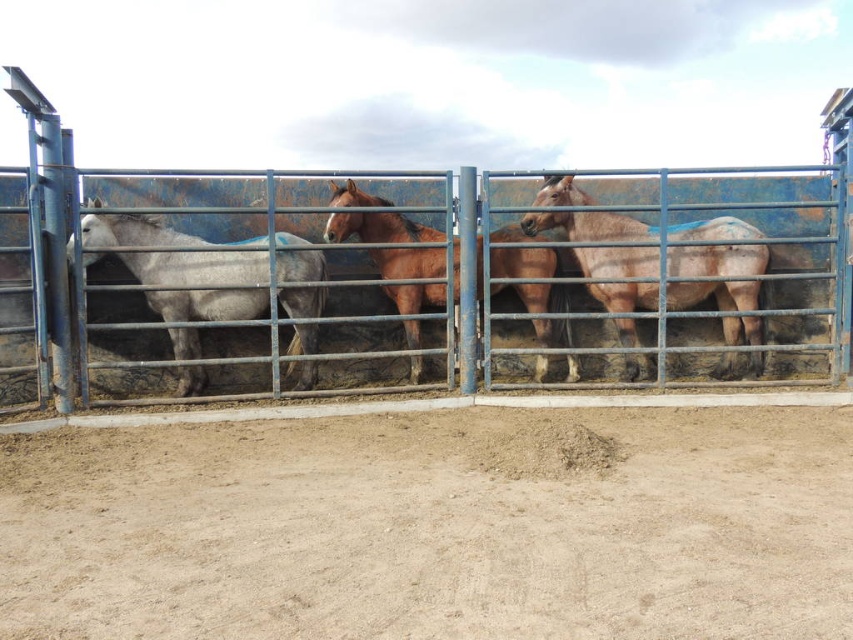
Question: Is gray matte horse at left bigger than brown glossy horse at center?

Choices:
 (A) no
 (B) yes

Answer: (A)

Question: Can you confirm if brown matte horse at center is positioned above gray matte horse at left?

Choices:
 (A) yes
 (B) no

Answer: (A)

Question: Which point is closer to the camera taking this photo?

Choices:
 (A) (555, 220)
 (B) (404, 218)
 (C) (117, 369)
 (D) (125, 234)

Answer: (D)

Question: Among these points, which one is farthest from the camera?

Choices:
 (A) tap(537, 268)
 (B) tap(601, 248)

Answer: (A)

Question: Can you confirm if blue metal fence at center is thinner than brown glossy horse at center?

Choices:
 (A) yes
 (B) no

Answer: (A)

Question: Which point appears closest to the camera in this image?

Choices:
 (A) (347, 234)
 (B) (711, 282)
 (C) (606, 216)
 (D) (292, 353)

Answer: (B)